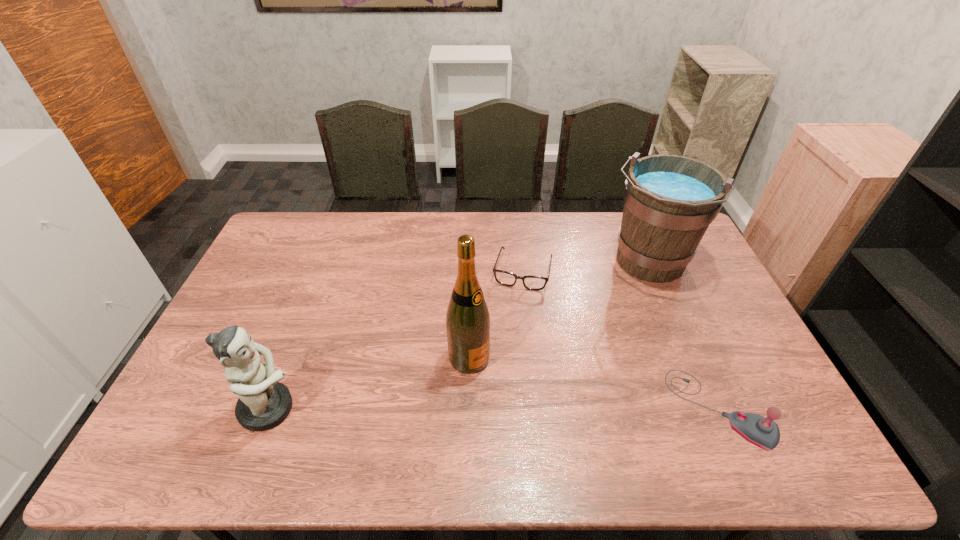
The image size is (960, 540). I want to click on vacant space on the desktop that is between the third tallest object and the joystick and is positioned on the front-facing side of the shortest object, so click(488, 409).

The image size is (960, 540). I want to click on free spot on the desktop that is between the third tallest object and the joystick and is positioned with a handle on the side of the fourth shortest object, so click(558, 409).

Identify the location of free space on the desktop that is between the third shortest object and the second shortest object and is positioned on the front-facing side of the wine bottle. (542, 409).